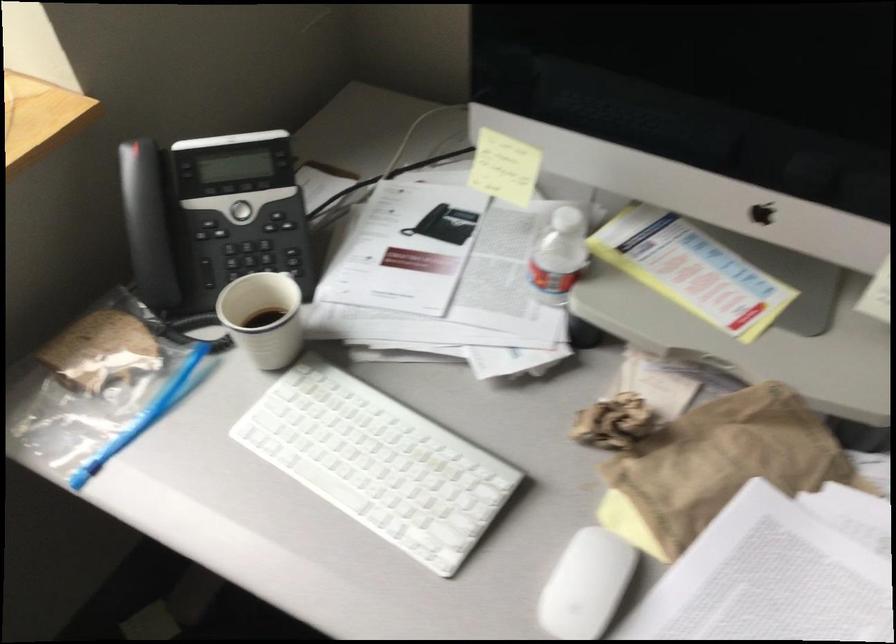
You are a GUI agent. You are given a task and a screenshot of the screen. Output one action in this format:
    pyautogui.click(x=<x>, y=<y>)
    Task: Click on the black phone handset
    This screenshot has width=896, height=644.
    Given the screenshot: What is the action you would take?
    pyautogui.click(x=142, y=203)